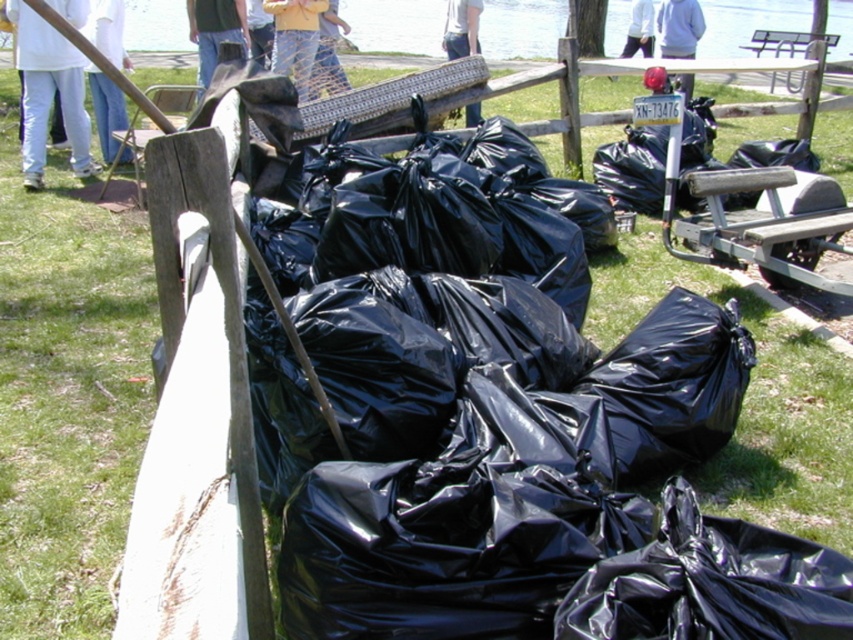
Is jeans at center below denim pants at upper center?

Yes, jeans at center is below denim pants at upper center.

Can you confirm if jeans at center is positioned above denim pants at upper center?

No, jeans at center is not above denim pants at upper center.

Which is in front, point (218, 26) or point (271, 28)?

Point (218, 26) is more forward.

The width and height of the screenshot is (853, 640). In order to click on jeans at center in this screenshot , I will do `click(215, 29)`.

Does white cotton pants at left appear on the left side of yellow shirt at center?

Indeed, white cotton pants at left is positioned on the left side of yellow shirt at center.

Does white cotton pants at left appear over yellow shirt at center?

Incorrect, white cotton pants at left is not positioned above yellow shirt at center.

Consider the image. Who is more forward, (83, 84) or (326, 10)?

Point (83, 84)

This screenshot has width=853, height=640. I want to click on white cotton pants at left, so click(x=48, y=92).

Between white cotton shirt at upper left and denim pants at upper center, which one has more height?

With more height is white cotton shirt at upper left.

The width and height of the screenshot is (853, 640). What do you see at coordinates (107, 113) in the screenshot?
I see `white cotton shirt at upper left` at bounding box center [107, 113].

This screenshot has width=853, height=640. I want to click on white cotton shirt at upper left, so click(x=107, y=113).